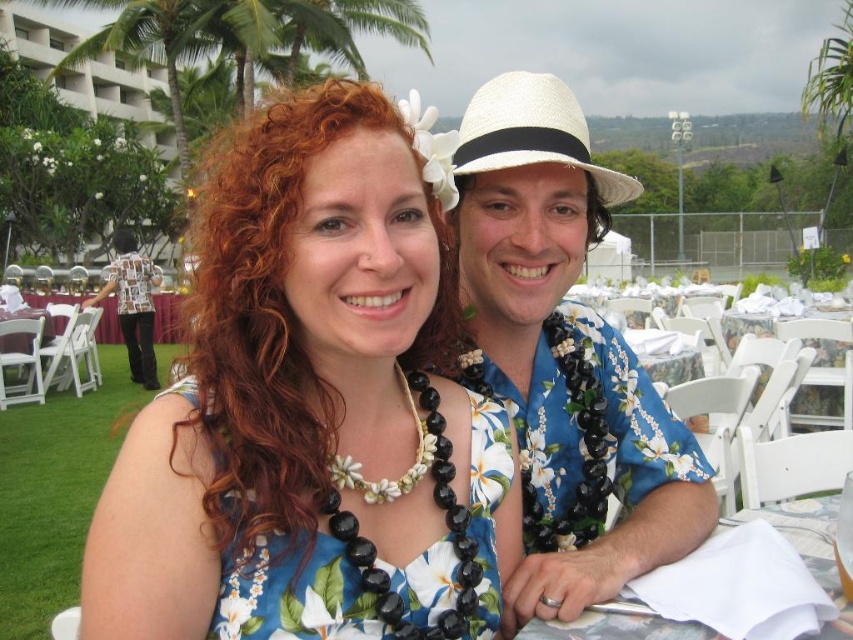
Which is more to the right, floral fabric dress at center or white straw hat at upper center?

white straw hat at upper center

Is floral fabric dress at center shorter than white straw hat at upper center?

Yes.

Between point (486, 557) and point (531, 116), which one is positioned behind?

The point (531, 116) is behind.

Locate an element on the screen. The width and height of the screenshot is (853, 640). floral fabric dress at center is located at coordinates (326, 586).

Can you confirm if floral dress at center is thinner than white paper napkin at lower right?

Correct, floral dress at center's width is less than white paper napkin at lower right's.

Is point (198, 332) farther from viewer compared to point (804, 550)?

No, it is not.

The height and width of the screenshot is (640, 853). In order to click on floral dress at center in this screenshot , I will do `click(310, 412)`.

At what (x,y) coordinates should I click in order to perform the action: click on floral dress at center. Please return your answer as a coordinate pair (x, y). The image size is (853, 640). Looking at the image, I should click on (310, 412).

Between point (274, 216) and point (405, 564), which one is positioned behind?

Point (405, 564)

Identify the location of floral dress at center. The image size is (853, 640). (310, 412).